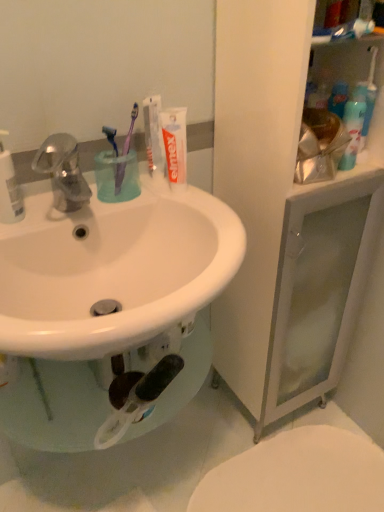
Locate an element on the screen. The height and width of the screenshot is (512, 384). free location to the right of purple plastic toothbrush at upper center, which ranks as the second toothbrush in right-to-left order is located at coordinates (171, 195).